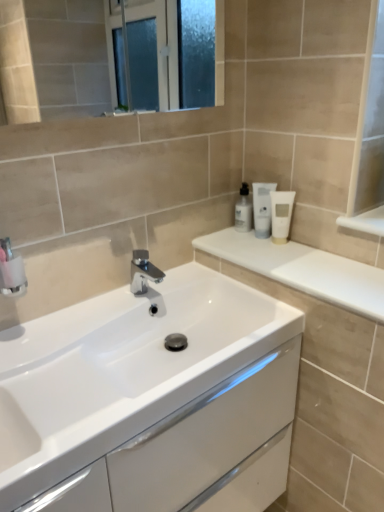
Identify the location of free space to the left of white matte tube at upper right, which is the 1th toiletry in right-to-left order. (228, 249).